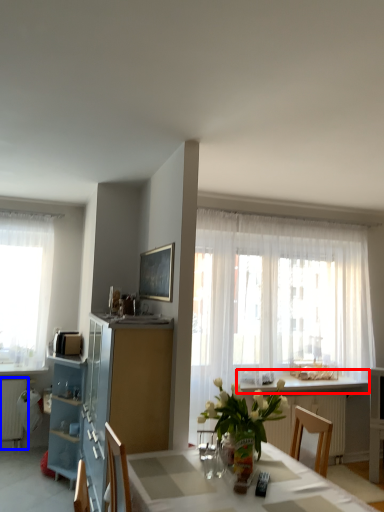
Question: Among these objects, which one is farthest to the camera, counter top (highlighted by a red box) or radiator (highlighted by a blue box)?

Choices:
 (A) counter top
 (B) radiator

Answer: (B)